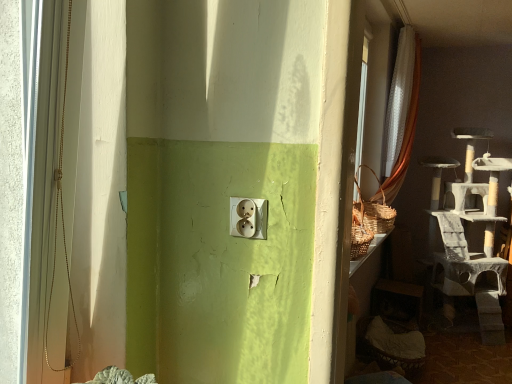
Question: Considering the positions of matte white outlet at center and white sheer curtain at upper right in the image, is matte white outlet at center wider or thinner than white sheer curtain at upper right?

Choices:
 (A) thin
 (B) wide

Answer: (A)

Question: Is matte white outlet at center taller or shorter than white sheer curtain at upper right?

Choices:
 (A) tall
 (B) short

Answer: (B)

Question: Choose the correct answer: Is matte white outlet at center inside white sheer curtain at upper right or outside it?

Choices:
 (A) outside
 (B) inside

Answer: (A)

Question: Based on their positions, is white sheer curtain at upper right located to the left or right of matte white outlet at center?

Choices:
 (A) left
 (B) right

Answer: (B)

Question: Which is correct: white sheer curtain at upper right is inside matte white outlet at center, or outside of it?

Choices:
 (A) outside
 (B) inside

Answer: (A)

Question: From a real-world perspective, relative to matte white outlet at center, is white sheer curtain at upper right vertically above or below?

Choices:
 (A) above
 (B) below

Answer: (A)

Question: Considering the positions of white sheer curtain at upper right and matte white outlet at center in the image, is white sheer curtain at upper right taller or shorter than matte white outlet at center?

Choices:
 (A) tall
 (B) short

Answer: (A)